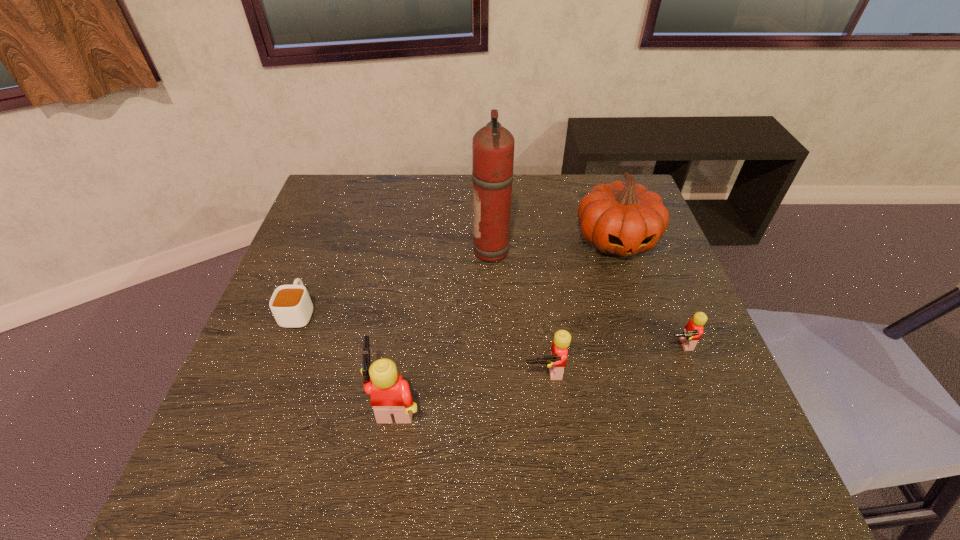
This screenshot has height=540, width=960. Identify the location of free space at the right edge of the desktop. (713, 368).

Find the location of `free space at the far left corner of the desktop`. free space at the far left corner of the desktop is located at coordinates (335, 211).

In order to click on vacant space at the near left corner of the desktop in this screenshot , I will do `click(242, 425)`.

The width and height of the screenshot is (960, 540). I want to click on free region at the far right corner, so click(x=588, y=176).

This screenshot has height=540, width=960. Find the location of `blank space at the near right corner of the desktop`. blank space at the near right corner of the desktop is located at coordinates (660, 402).

You are a GUI agent. You are given a task and a screenshot of the screen. Output one action in this format:
    pyautogui.click(x=<x>, y=<y>)
    Task: Click on the free point between the shortest object and the pumpkin
    The width and height of the screenshot is (960, 540).
    Given the screenshot: What is the action you would take?
    [458, 275]

Find the location of a particular element. Image resolution: width=960 pixels, height=540 pixels. blank region between the second Lego from right to left and the second object from left to right is located at coordinates (470, 386).

This screenshot has width=960, height=540. I want to click on free space between the fourth nearest object and the second tallest Lego, so click(422, 341).

Identify the location of empty space that is in between the pumpkin and the tallest object. The width and height of the screenshot is (960, 540). (555, 246).

The width and height of the screenshot is (960, 540). What are the coordinates of `vacant area between the second object from left to right and the pumpkin` in the screenshot? It's located at (506, 320).